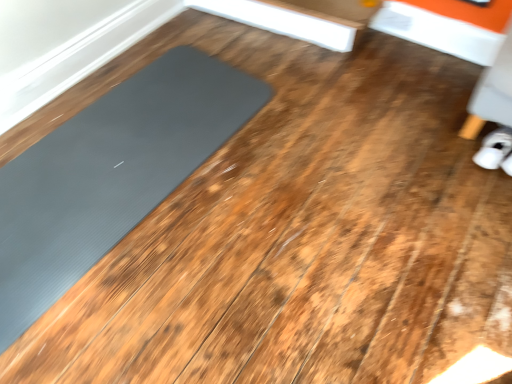
Image resolution: width=512 pixels, height=384 pixels. Identify the location of free space behind white fabric shoe at lower right. (461, 128).